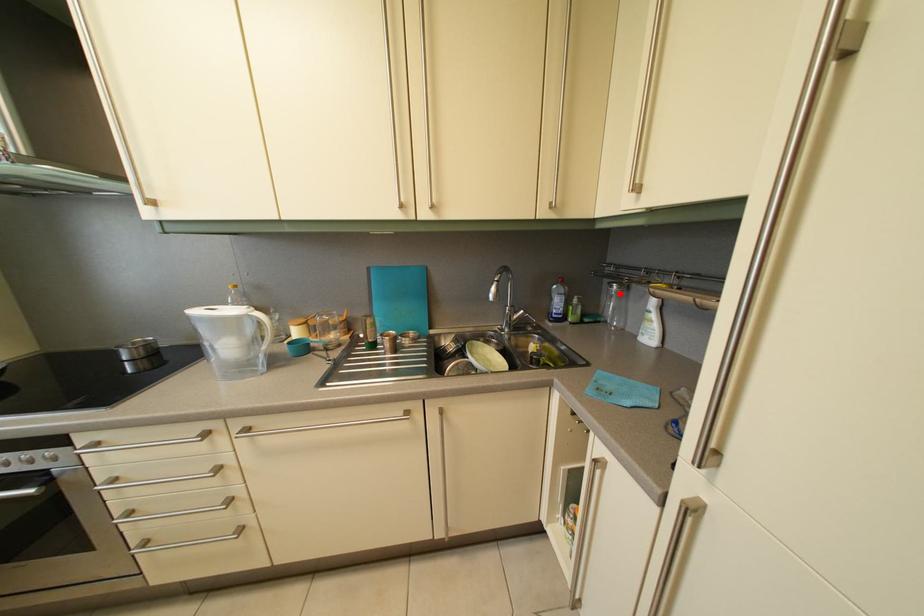
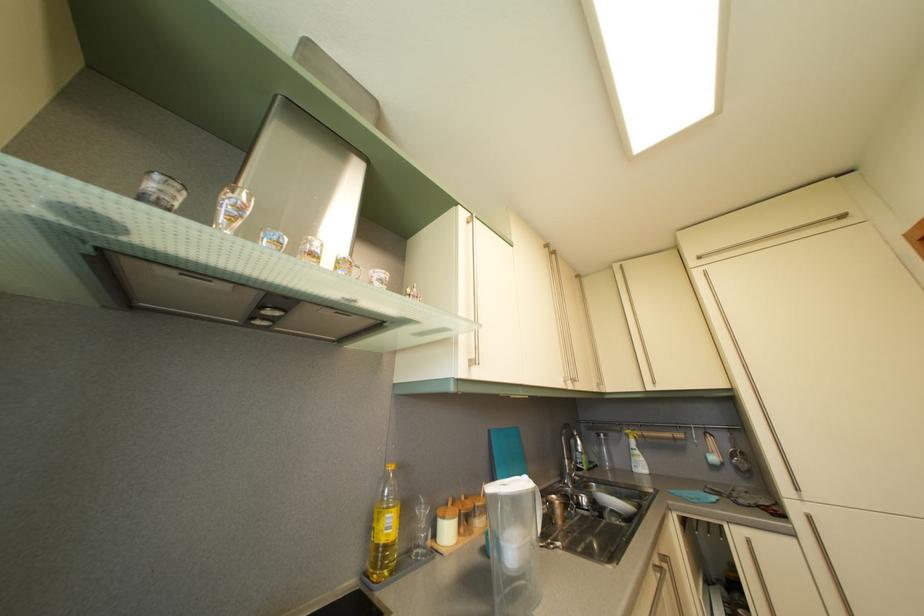
Question: I am providing you with two images of the same scene from different viewpoints. Given a red point in image1, look at the same physical point in image2. Is it:

Choices:
 (A) Closer to the viewpoint
 (B) Farther from the viewpoint

Answer: (B)